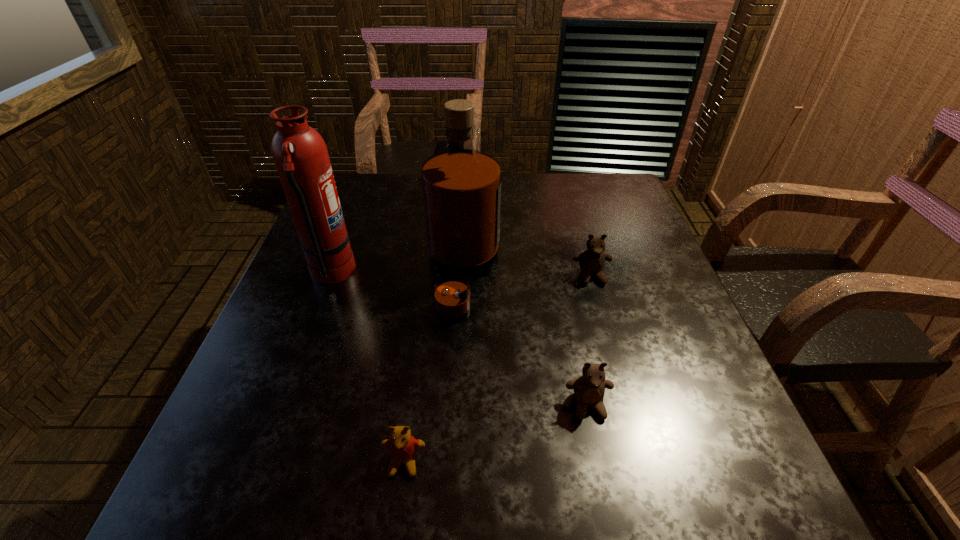
Locate an element on the screen. The height and width of the screenshot is (540, 960). free area in between the shortest object and the farthest teddy bear is located at coordinates (497, 369).

This screenshot has width=960, height=540. I want to click on vacant area that lies between the fourth farthest object and the fire extinguisher, so click(x=460, y=339).

Locate an element on the screen. empty location between the second farthest teddy bear and the leftmost object is located at coordinates (460, 339).

Identify the location of vacant space in between the shortest object and the second nearest teddy bear. This screenshot has width=960, height=540. (496, 434).

The image size is (960, 540). I want to click on free space that is in between the liquor and the shortest teddy bear, so (x=434, y=369).

What are the coordinates of `free space between the fire extinguisher and the fourth farthest object` in the screenshot? It's located at (460, 339).

Where is `vacant space that's between the liquor and the second nearest object`? vacant space that's between the liquor and the second nearest object is located at coordinates (526, 340).

Image resolution: width=960 pixels, height=540 pixels. In order to click on object that stands as the fourth closest to the farthest teddy bear in this screenshot , I will do `click(300, 154)`.

Locate an element on the screen. This screenshot has width=960, height=540. the fourth closest object to the farthest teddy bear is located at coordinates (300, 154).

Locate an element on the screen. the closest teddy bear to the liquor is located at coordinates (592, 261).